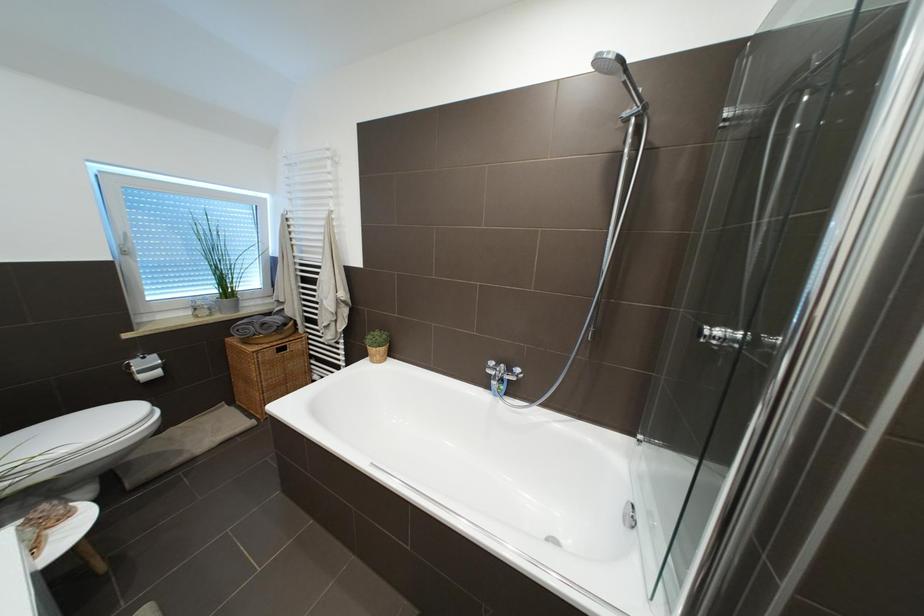
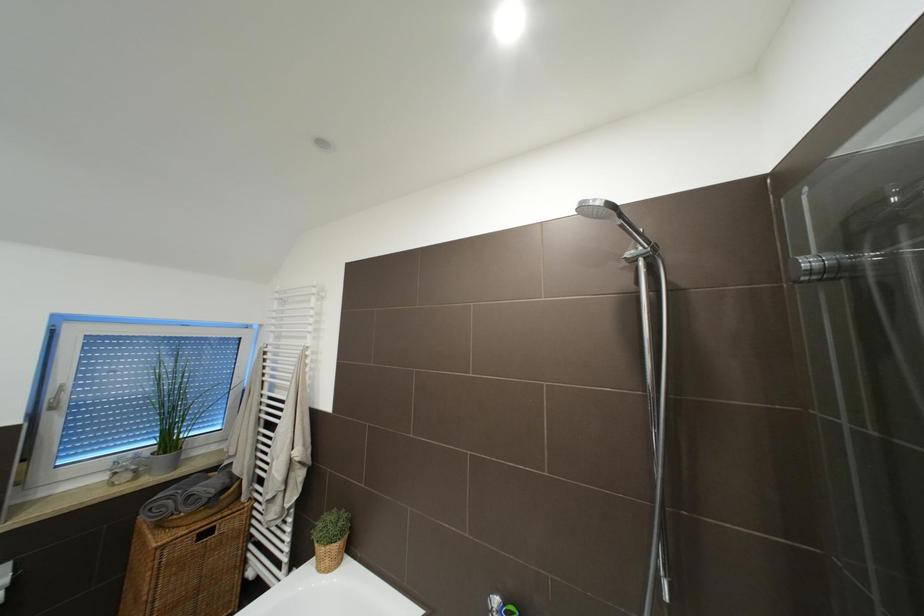
The images are taken continuously from a first-person perspective. In which direction are you moving?

The cameraman walked toward right, forward.